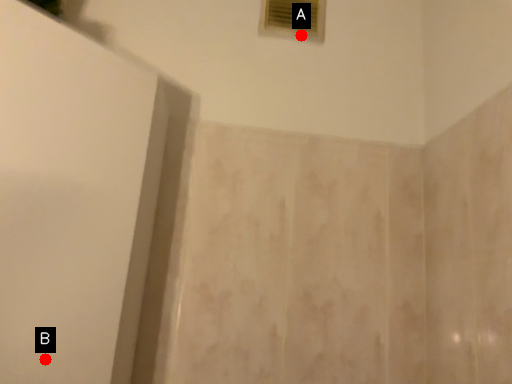
Question: Two points are circled on the image, labeled by A and B beside each circle. Which point appears farthest from the camera in this image?

Choices:
 (A) A is further
 (B) B is further

Answer: (A)